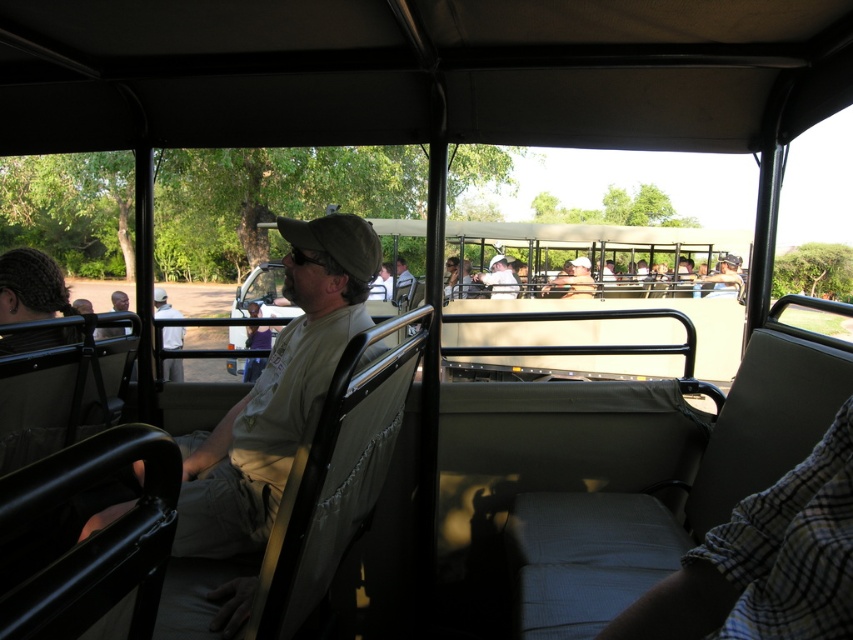
You are a safari tour guide and need to determine if a small backpack can fit between the light brown leather jacket at center and the matte khaki shirt at center. The backpack measures 30 cm in width. What should you consider?

The light brown leather jacket at center is bigger than the matte khaki shirt at center. Therefore, the space between them may be sufficient for the 30 cm backpack, but you should check the actual distance to confirm.

You are a safari guide standing in the safari vehicle and need to hand out a map to both the khaki fabric shirt at center and the light brown leather jacket at center. Which passenger should you hand the map to first if you want to give the taller one first?

The light brown leather jacket at center is taller than the khaki fabric shirt at center, so you should hand the map to the light brown leather jacket at center first.

You are sitting in the safari vehicle and want to point out an animal to the person sitting at point [498,273]. To do this, you need to gesture towards point [310,237]. Will your gesture be visible to them?

Yes, because point [310,237] is in front of point [498,273], so the person at point [498,273] can see the gesture directed towards the point in front of them.